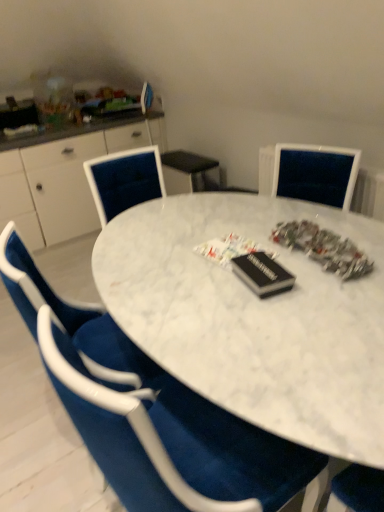
Question: Would you consider velvet blue chair at center to be distant from white marble table at center?

Choices:
 (A) yes
 (B) no

Answer: (B)

Question: Is velvet blue chair at center located outside white marble table at center?

Choices:
 (A) no
 (B) yes

Answer: (A)

Question: Is velvet blue chair at center facing towards white marble table at center?

Choices:
 (A) yes
 (B) no

Answer: (A)

Question: Is velvet blue chair at center placed right next to white marble table at center?

Choices:
 (A) no
 (B) yes

Answer: (A)

Question: Is velvet blue chair at center at the right side of white marble table at center?

Choices:
 (A) no
 (B) yes

Answer: (A)

Question: Is white glossy cabinet at left to the left or to the right of velvet blue chair at center in the image?

Choices:
 (A) left
 (B) right

Answer: (A)

Question: Is point (69, 183) closer or farther from the camera than point (233, 473)?

Choices:
 (A) closer
 (B) farther

Answer: (B)

Question: Considering the positions of white glossy cabinet at left and velvet blue chair at center in the image, is white glossy cabinet at left taller or shorter than velvet blue chair at center?

Choices:
 (A) short
 (B) tall

Answer: (A)

Question: Choose the correct answer: Is white glossy cabinet at left inside velvet blue chair at center or outside it?

Choices:
 (A) inside
 (B) outside

Answer: (B)

Question: Relative to velvet blue chair at center, is white marble table at center in front or behind?

Choices:
 (A) behind
 (B) front

Answer: (A)

Question: From the image's perspective, is white marble table at center positioned above or below velvet blue chair at center?

Choices:
 (A) below
 (B) above

Answer: (B)

Question: Is point (266, 245) positioned closer to the camera than point (100, 417)?

Choices:
 (A) farther
 (B) closer

Answer: (A)

Question: Is white marble table at center taller or shorter than velvet blue chair at center?

Choices:
 (A) short
 (B) tall

Answer: (A)

Question: In terms of width, does white glossy cabinet at left look wider or thinner when compared to white marble table at center?

Choices:
 (A) thin
 (B) wide

Answer: (A)

Question: Would you say white glossy cabinet at left is inside or outside white marble table at center?

Choices:
 (A) outside
 (B) inside

Answer: (A)